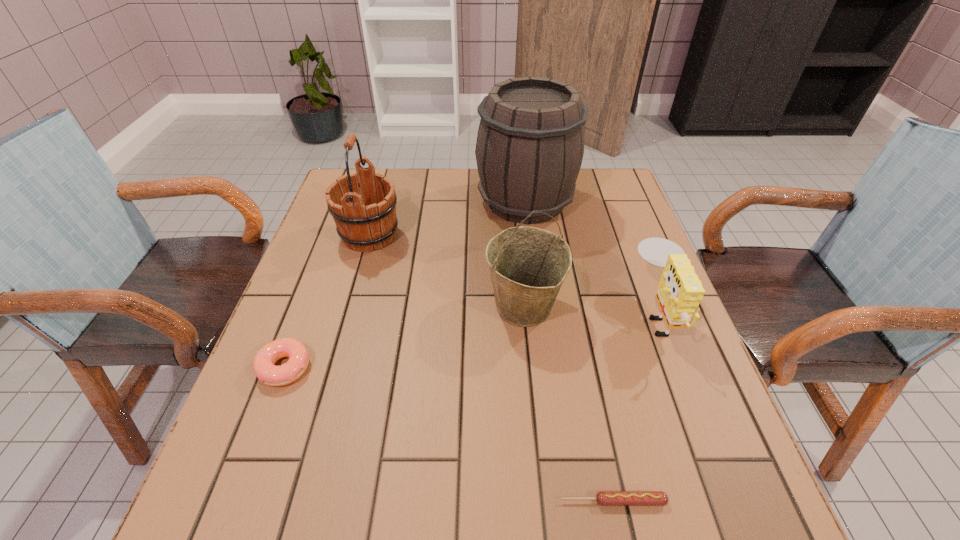
This screenshot has height=540, width=960. Identify the location of vacant space located 0.100m on the front-facing side of the fourth tallest object. (591, 314).

Find the location of a particular element. The width and height of the screenshot is (960, 540). vacant space located 0.240m on the front-facing side of the fourth tallest object is located at coordinates (529, 314).

I want to click on free space located 0.070m on the right of the doughnut, so click(x=345, y=368).

At what (x,y) coordinates should I click in order to perform the action: click on vacant space positioned on the left of the sausage. Please return your answer as a coordinate pair (x, y). Looking at the image, I should click on point(435,501).

Image resolution: width=960 pixels, height=540 pixels. Find the location of `object located at the far edge`. object located at the far edge is located at coordinates (530, 144).

The width and height of the screenshot is (960, 540). What are the coordinates of `object present at the near edge` in the screenshot? It's located at (604, 498).

Locate an element on the screen. This screenshot has height=540, width=960. wine bucket that is at the left edge is located at coordinates point(362,226).

I want to click on doughnut present at the left edge, so click(x=268, y=373).

Find the location of `wine bucket at the right edge`. wine bucket at the right edge is located at coordinates (530, 144).

Where is `sponge present at the right edge`? The width and height of the screenshot is (960, 540). sponge present at the right edge is located at coordinates (680, 291).